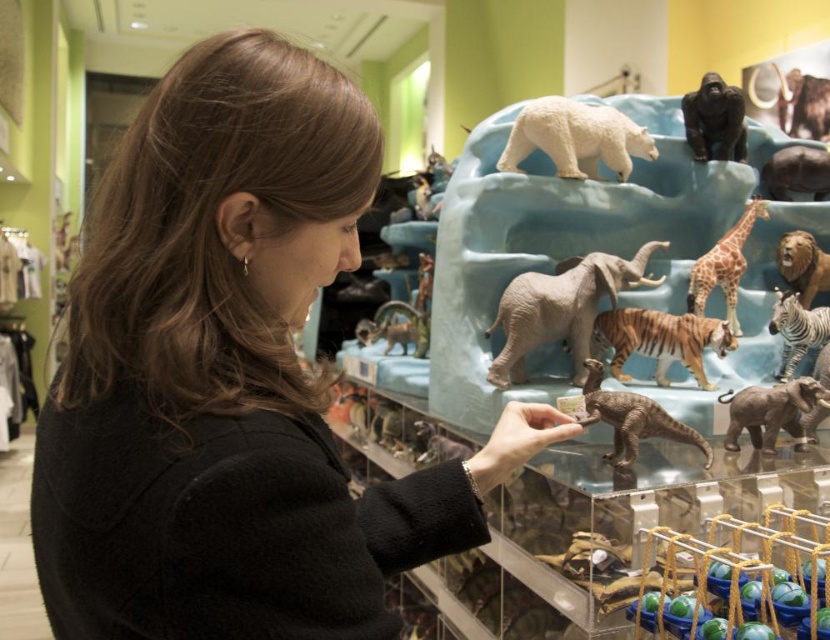
Does spotted giraffe at center come in front of white glossy zebra at right?

Yes, it is in front of white glossy zebra at right.

Who is more distant from viewer, [714,252] or [784,298]?

Point [714,252]

You are a GUI agent. You are given a task and a screenshot of the screen. Output one action in this format:
    pyautogui.click(x=<x>, y=<y>)
    Task: Click on the spotted giraffe at center
    The width and height of the screenshot is (830, 640).
    Given the screenshot: What is the action you would take?
    (724, 266)

The image size is (830, 640). Find the location of `spotted giraffe at center`. spotted giraffe at center is located at coordinates (724, 266).

Is white matte polar bear at upper center smaller than white glossy zebra at right?

No.

Which is in front, point (558, 120) or point (796, 298)?

Point (558, 120) is in front.

At what (x,y) coordinates should I click in order to perform the action: click on white matte polar bear at upper center. Please return your answer as a coordinate pair (x, y). This screenshot has width=830, height=640. Looking at the image, I should click on tap(575, 138).

The image size is (830, 640). What do you see at coordinates (796, 330) in the screenshot? I see `white glossy zebra at right` at bounding box center [796, 330].

Can you confirm if white glossy zebra at right is positioned to the left of brown fur lion at upper right?

Correct, you'll find white glossy zebra at right to the left of brown fur lion at upper right.

Where is `white glossy zebra at right`? This screenshot has width=830, height=640. white glossy zebra at right is located at coordinates (796, 330).